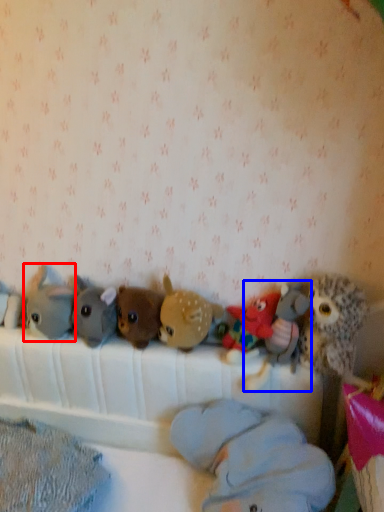
Question: Which object appears farthest to the camera in this image, toy (highlighted by a red box) or toy (highlighted by a blue box)?

Choices:
 (A) toy
 (B) toy

Answer: (A)